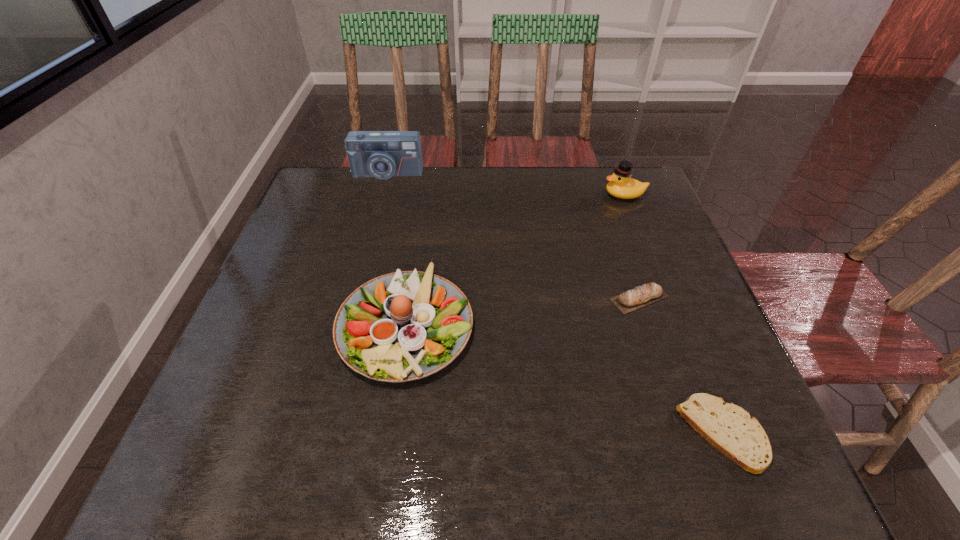
At what (x,y) coordinates should I click in order to perform the action: click on object that is the second closest to the nearest object. Please return your answer as a coordinate pair (x, y). The height and width of the screenshot is (540, 960). Looking at the image, I should click on (403, 326).

Find the location of `vacant point that satisfies the following two spatial constraints: 1. on the back side of the shorter pita bread; 2. on the front-facing side of the duck`. vacant point that satisfies the following two spatial constraints: 1. on the back side of the shorter pita bread; 2. on the front-facing side of the duck is located at coordinates (628, 195).

Where is `free spot that satisfies the following two spatial constraints: 1. on the back side of the salad plate; 2. on the right side of the taller pita bread`? This screenshot has height=540, width=960. free spot that satisfies the following two spatial constraints: 1. on the back side of the salad plate; 2. on the right side of the taller pita bread is located at coordinates (410, 298).

The width and height of the screenshot is (960, 540). I want to click on vacant space that satisfies the following two spatial constraints: 1. on the front side of the nearer pita bread; 2. on the right side of the salad plate, so pos(390,434).

You are a GUI agent. You are given a task and a screenshot of the screen. Output one action in this format:
    pyautogui.click(x=<x>, y=<y>)
    Task: Click on the free space that satisfies the following two spatial constraints: 1. on the lens of the camera; 2. on the left side of the taller pita bread
    
    Given the screenshot: What is the action you would take?
    pyautogui.click(x=353, y=298)

This screenshot has height=540, width=960. In order to click on vacant point that satisfies the following two spatial constraints: 1. on the lens of the farthest object; 2. on the left side of the salad plate in this screenshot , I will do `click(347, 325)`.

Locate an element on the screen. This screenshot has width=960, height=540. free spot that satisfies the following two spatial constraints: 1. on the lens of the tallest object; 2. on the right side of the salad plate is located at coordinates (347, 325).

The height and width of the screenshot is (540, 960). In order to click on vacant region that satisfies the following two spatial constraints: 1. on the lens of the salad plate; 2. on the left side of the camera in this screenshot , I will do `click(347, 325)`.

Find the location of a particular element. The image size is (960, 540). vacant space that satisfies the following two spatial constraints: 1. on the lens of the nearer pita bread; 2. on the right side of the tallest object is located at coordinates (318, 434).